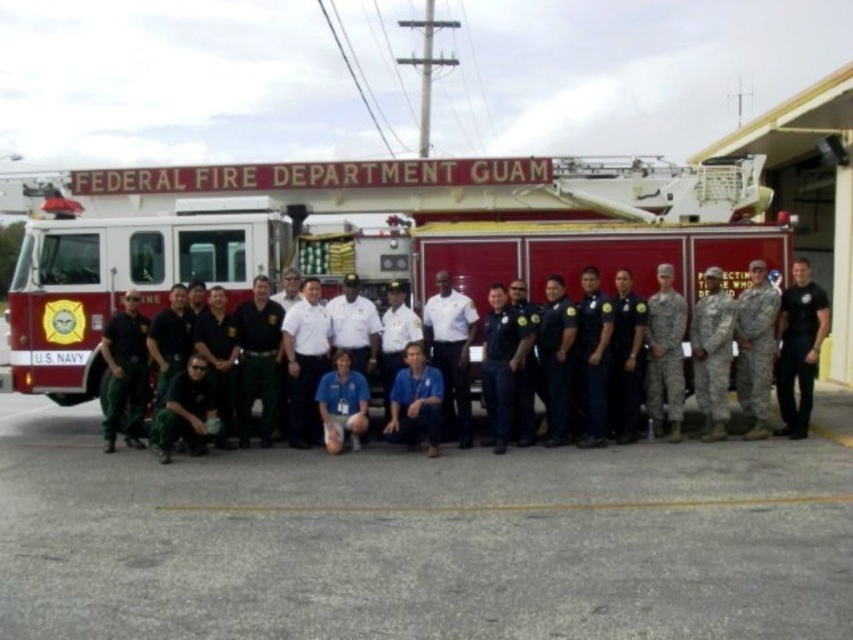
You are standing in front of the fire truck and want to move from the point at coordinate point (244,406) to the point at coordinate point (579,380). Can you walk directly between them without needing to move around any obstacles?

Point (244,406) is behind point (579,380), so you cannot walk directly between them without moving around the obstacle in front of you.